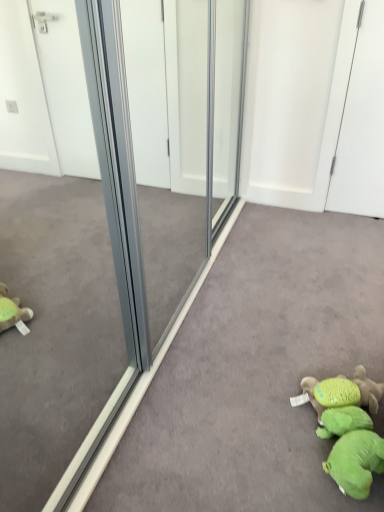
Question: Is there a large distance between green plush toy at lower right, which is counted as the 1th toy, starting from the back, and green plush toy at lower right, the 2th toy viewed from the back?

Choices:
 (A) no
 (B) yes

Answer: (A)

Question: Is the surface of green plush toy at lower right, the second toy positioned from the front, in direct contact with green plush toy at lower right, the 2th toy viewed from the back?

Choices:
 (A) no
 (B) yes

Answer: (B)

Question: Considering the relative sizes of green plush toy at lower right, which is counted as the 1th toy, starting from the back, and green plush toy at lower right, the 2th toy viewed from the back, in the image provided, is green plush toy at lower right, which is counted as the 1th toy, starting from the back, smaller than green plush toy at lower right, the 2th toy viewed from the back,?

Choices:
 (A) no
 (B) yes

Answer: (B)

Question: Is the position of green plush toy at lower right, the second toy positioned from the front, more distant than that of green plush toy at lower right, the 2th toy viewed from the back?

Choices:
 (A) yes
 (B) no

Answer: (A)

Question: From the image's perspective, is green plush toy at lower right, the second toy positioned from the front, located beneath green plush toy at lower right, marked as the 1th toy in a front-to-back arrangement?

Choices:
 (A) no
 (B) yes

Answer: (A)

Question: Is green plush toy at lower right, the 2th toy viewed from the back, taller or shorter than white glossy screen door at upper right?

Choices:
 (A) tall
 (B) short

Answer: (B)

Question: From the image's perspective, relative to white glossy screen door at upper right, is green plush toy at lower right, the 2th toy viewed from the back, above or below?

Choices:
 (A) above
 (B) below

Answer: (B)

Question: Relative to white glossy screen door at upper right, is green plush toy at lower right, the 2th toy viewed from the back, in front or behind?

Choices:
 (A) behind
 (B) front

Answer: (B)

Question: From a real-world perspective, is green plush toy at lower right, marked as the 1th toy in a front-to-back arrangement, physically located above or below white glossy screen door at upper right?

Choices:
 (A) above
 (B) below

Answer: (B)

Question: From the image's perspective, relative to green plush toy at lower right, the 2th toy viewed from the back, is green plush toy at lower right, which is counted as the 1th toy, starting from the back, above or below?

Choices:
 (A) above
 (B) below

Answer: (A)

Question: Does point (362, 372) appear closer or farther from the camera than point (322, 428)?

Choices:
 (A) farther
 (B) closer

Answer: (A)

Question: Is green plush toy at lower right, which is counted as the 1th toy, starting from the back, wider or thinner than green plush toy at lower right, marked as the 1th toy in a front-to-back arrangement?

Choices:
 (A) thin
 (B) wide

Answer: (B)

Question: In terms of height, does green plush toy at lower right, which is counted as the 1th toy, starting from the back, look taller or shorter compared to green plush toy at lower right, marked as the 1th toy in a front-to-back arrangement?

Choices:
 (A) tall
 (B) short

Answer: (A)

Question: Looking at the image, does green plush toy at lower right, the second toy positioned from the front, seem bigger or smaller compared to white glossy screen door at upper right?

Choices:
 (A) big
 (B) small

Answer: (B)

Question: From the image's perspective, is green plush toy at lower right, the second toy positioned from the front, located above or below white glossy screen door at upper right?

Choices:
 (A) below
 (B) above

Answer: (A)